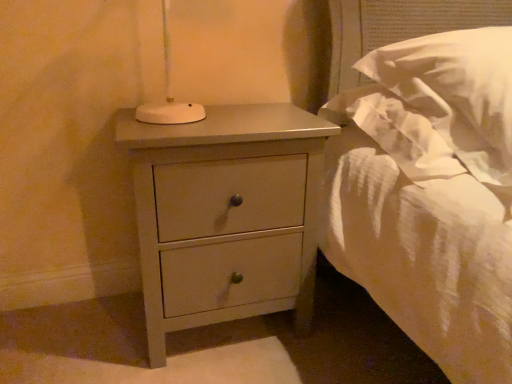
Question: In terms of size, does white soft pillow at upper right appear bigger or smaller than matte gray nightstand at lower left?

Choices:
 (A) small
 (B) big

Answer: (B)

Question: Is white soft pillow at upper right in front of or behind matte gray nightstand at lower left in the image?

Choices:
 (A) behind
 (B) front

Answer: (B)

Question: In the image, is white soft pillow at upper right on the left side or the right side of matte gray nightstand at lower left?

Choices:
 (A) left
 (B) right

Answer: (B)

Question: In terms of width, does matte gray nightstand at lower left look wider or thinner when compared to white soft pillow at upper right?

Choices:
 (A) thin
 (B) wide

Answer: (A)

Question: Would you say matte gray nightstand at lower left is inside or outside white soft pillow at upper right?

Choices:
 (A) inside
 (B) outside

Answer: (B)

Question: Considering the positions of matte gray nightstand at lower left and white soft pillow at upper right in the image, is matte gray nightstand at lower left bigger or smaller than white soft pillow at upper right?

Choices:
 (A) small
 (B) big

Answer: (A)

Question: Is matte gray nightstand at lower left taller or shorter than white soft pillow at upper right?

Choices:
 (A) tall
 (B) short

Answer: (A)